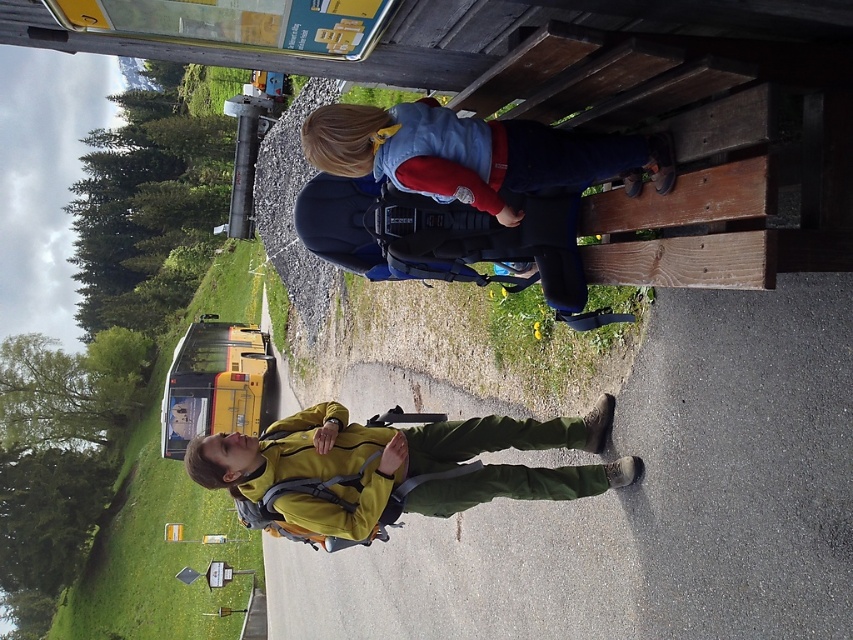
Between point (451, 188) and point (163, 413), which one is positioned in front?

Positioned in front is point (451, 188).

Is denim jacket at upper center thinner than yellow matte school bus at left?

Yes.

Based on the photo, who is more forward, (310, 136) or (216, 387)?

Point (310, 136) is in front.

Locate an element on the screen. denim jacket at upper center is located at coordinates (474, 154).

Does matte yellow jacket at lower center have a lesser width compared to yellow matte school bus at left?

Indeed, matte yellow jacket at lower center has a lesser width compared to yellow matte school bus at left.

Who is more distant from viewer, (x=427, y=493) or (x=227, y=428)?

Positioned behind is point (x=227, y=428).

Between point (282, 515) and point (167, 458), which one is positioned in front?

Point (282, 515) is in front.

Where is `matte yellow jacket at lower center`? Image resolution: width=853 pixels, height=640 pixels. matte yellow jacket at lower center is located at coordinates (396, 467).

Who is shorter, matte yellow jacket at lower center or denim jacket at upper center?

denim jacket at upper center

Describe the element at coordinates (396, 467) in the screenshot. I see `matte yellow jacket at lower center` at that location.

I want to click on matte yellow jacket at lower center, so click(396, 467).